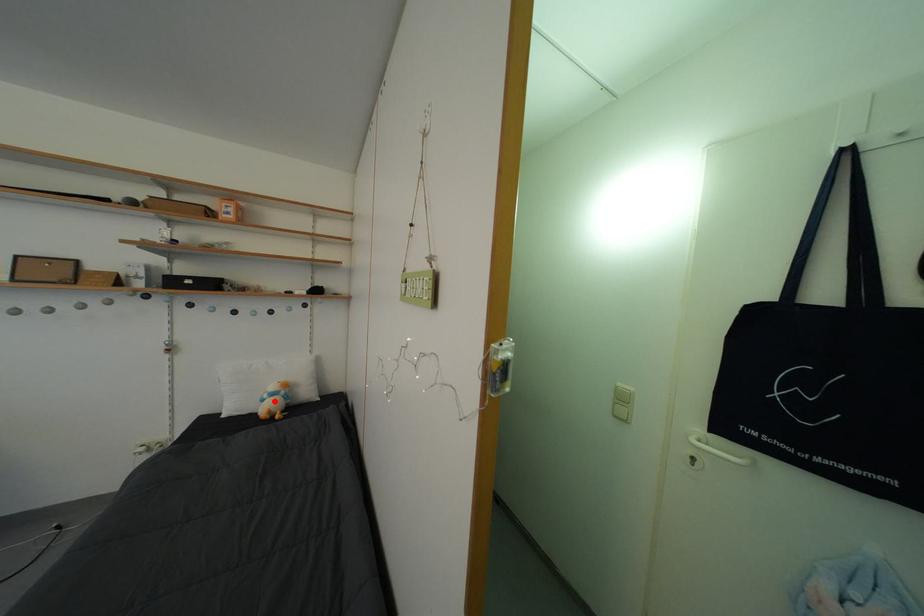
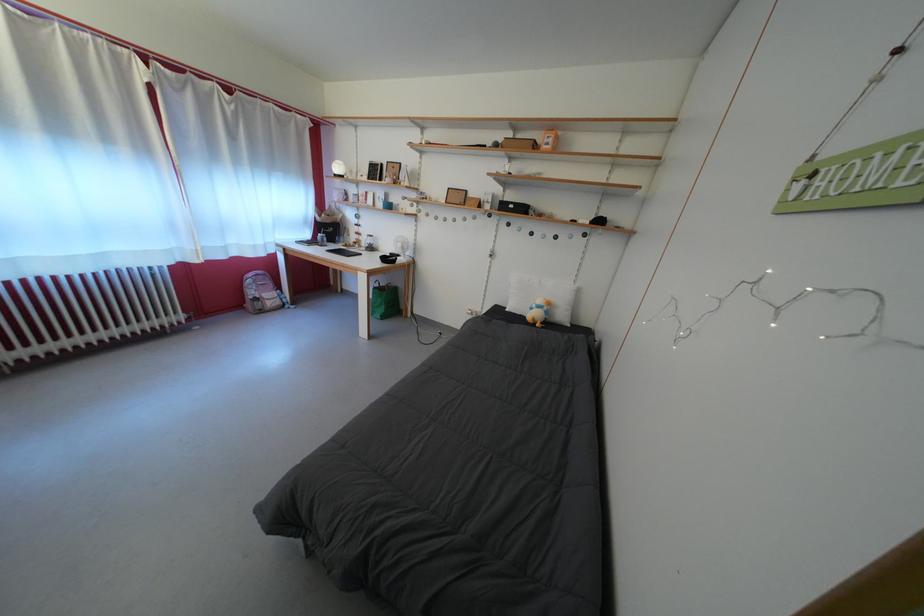
Question: I am providing you with two images of the same scene from different viewpoints. Given a red point in image1, look at the same physical point in image2. Is it:

Choices:
 (A) Closer to the viewpoint
 (B) Farther from the viewpoint

Answer: (A)